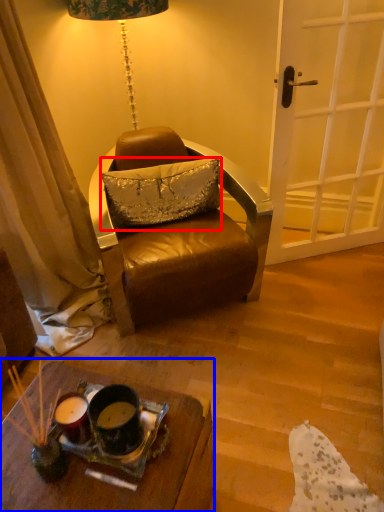
Question: Among these objects, which one is nearest to the camera, pillow (highlighted by a red box) or desk (highlighted by a blue box)?

Choices:
 (A) pillow
 (B) desk

Answer: (B)